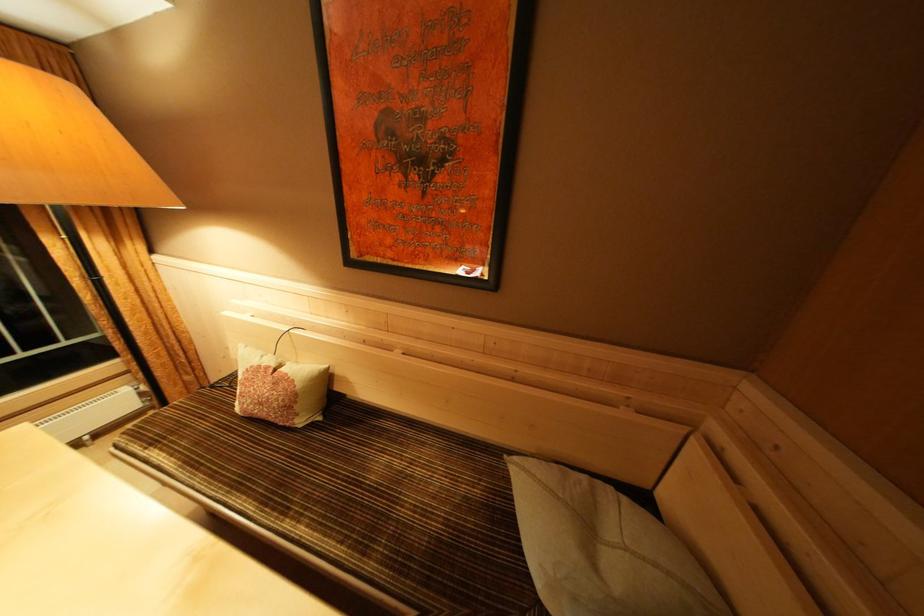
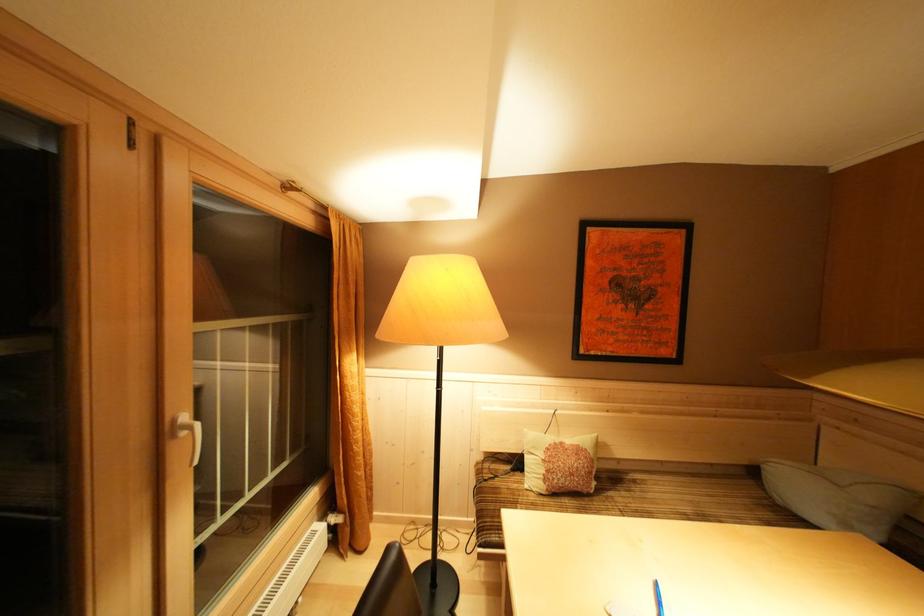
Locate, in the second image, the point that corresponds to pixel 274 373 in the first image.

(568, 448)